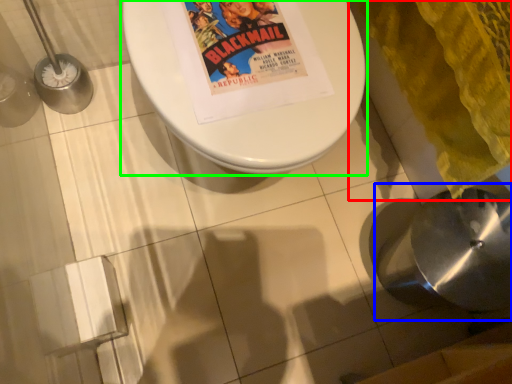
Question: Which object is positioned closest to blanket (highlighted by a red box)? Select from sink (highlighted by a blue box) and toilet (highlighted by a green box).

Choices:
 (A) sink
 (B) toilet

Answer: (A)